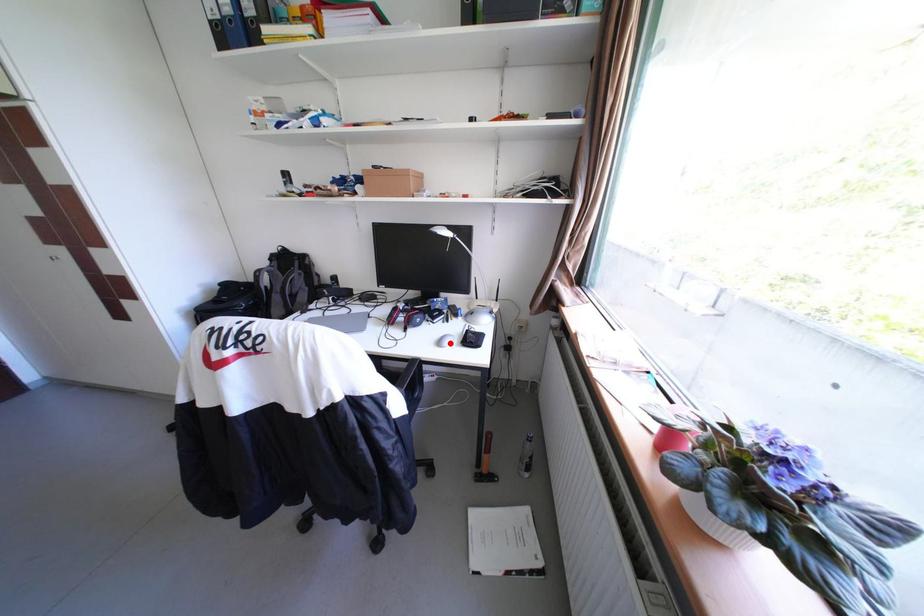
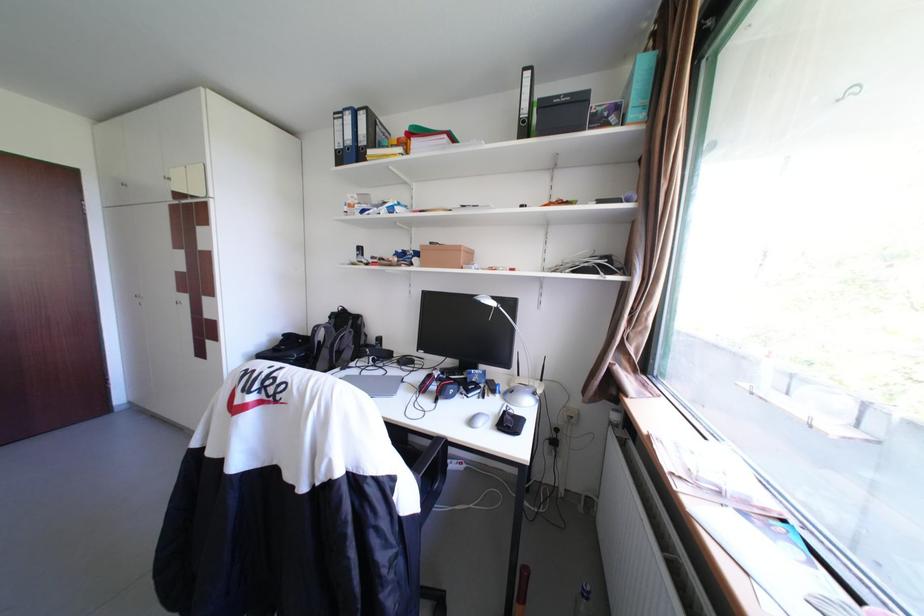
Where in the second image is the point corresponding to the highlighted location from the first image?

(481, 422)